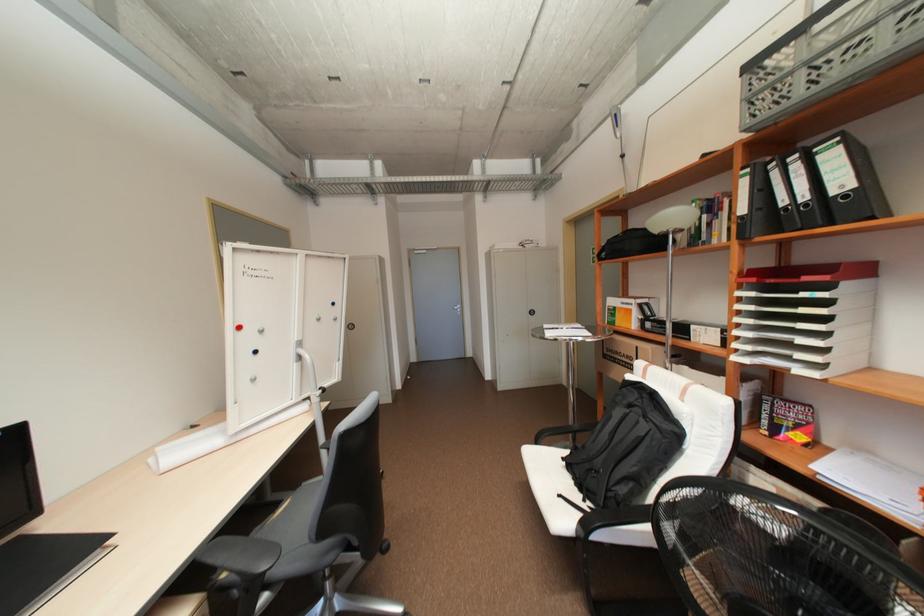
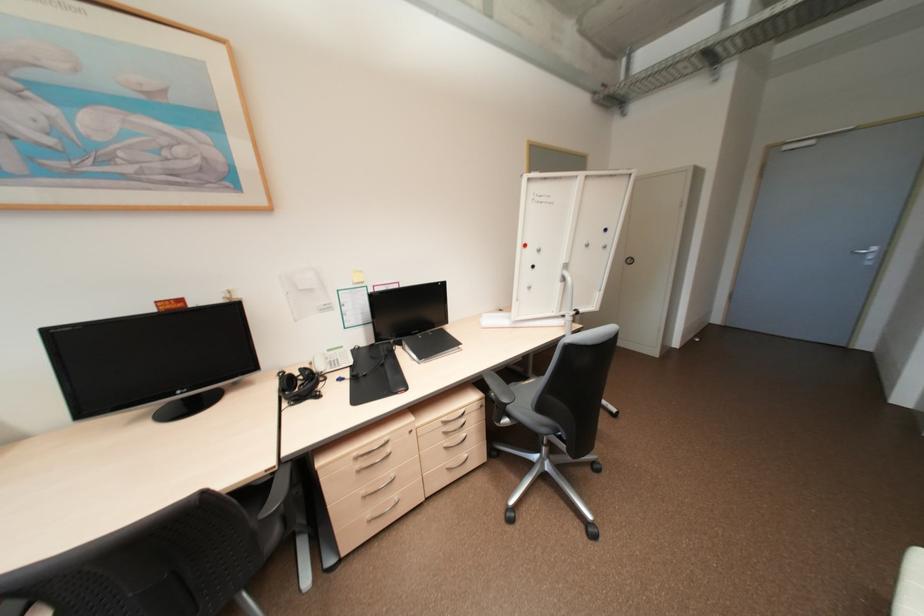
In the second image, find the point that corresponds to point 261,352 in the first image.

(539, 265)